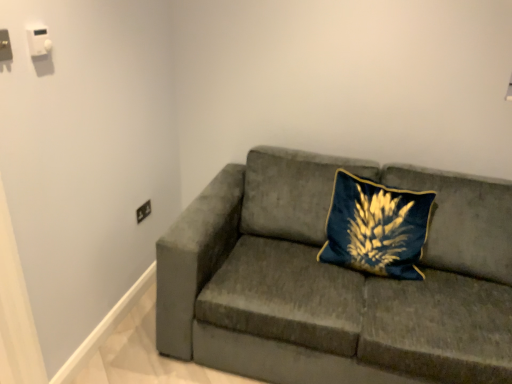
Question: Considering their positions, is black plastic electrical outlet at lower left, arranged as the 3th electric outlet when viewed from the left, located in front of or behind matte black socket at upper left, the second electric outlet viewed from the top?

Choices:
 (A) behind
 (B) front

Answer: (A)

Question: Would you say black plastic electrical outlet at lower left, which ranks as the 3th electric outlet in front-to-back order, is inside or outside matte black socket at upper left, positioned as the 1th electric outlet in left-to-right order?

Choices:
 (A) outside
 (B) inside

Answer: (A)

Question: Which object is positioned farthest from the black plastic electrical outlet at lower left, placed as the first electric outlet when sorted from bottom to top?

Choices:
 (A) velvet blue pillow at center
 (B) velvet gray couch at center
 (C) matte black socket at upper left, which ranks as the 3th electric outlet in back-to-front order
 (D) white plastic switch at upper left, placed as the first electric outlet when sorted from top to bottom

Answer: (A)

Question: Which is farther from the white plastic switch at upper left, which ranks as the 2th electric outlet in left-to-right order?

Choices:
 (A) matte black socket at upper left, which ranks as the 3th electric outlet in back-to-front order
 (B) velvet blue pillow at center
 (C) black plastic electrical outlet at lower left, marked as the third electric outlet in a top-to-bottom arrangement
 (D) velvet gray couch at center

Answer: (B)